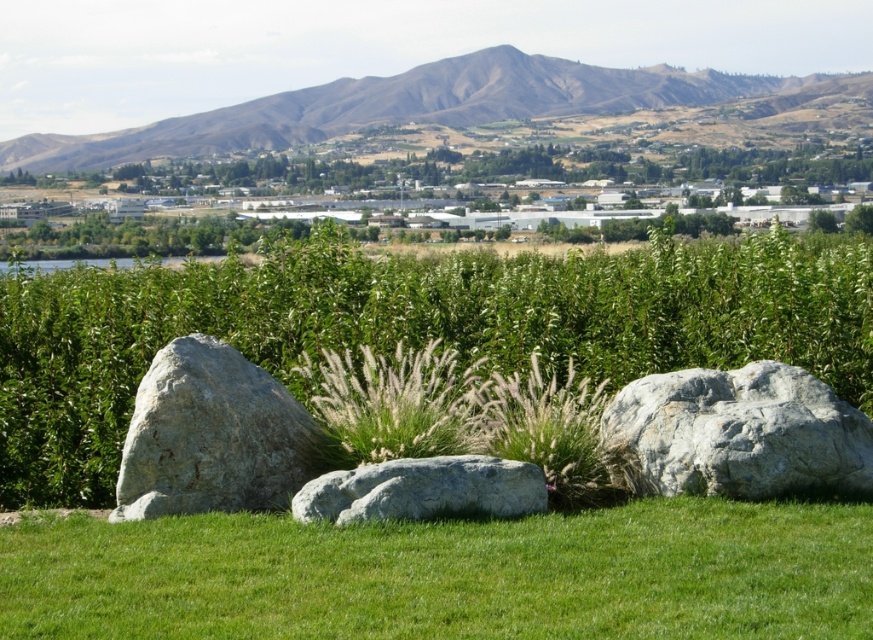
Which is above, brown/dry soil mountain at upper center or gray rock at center-right?

Positioned higher is brown/dry soil mountain at upper center.

Which is in front, point (686, 72) or point (727, 492)?

Positioned in front is point (727, 492).

Locate an element on the screen. The width and height of the screenshot is (873, 640). brown/dry soil mountain at upper center is located at coordinates (425, 106).

Find the location of a particular element. brown/dry soil mountain at upper center is located at coordinates (425, 106).

Is green grass at lower center positioned in front of gray rough boulder at center-left?

That is True.

Is green grass at lower center bigger than gray rough boulder at center-left?

No.

Which is behind, point (810, 561) or point (220, 444)?

The point (220, 444) is more distant.

Find the location of a particular element. The height and width of the screenshot is (640, 873). green grass at lower center is located at coordinates (450, 573).

Can you confirm if green leafy hedge at center is smaller than green grass at lower center?

Incorrect, green leafy hedge at center is not smaller in size than green grass at lower center.

Where is `green leafy hedge at center`? green leafy hedge at center is located at coordinates (411, 326).

At what (x,y) coordinates should I click in order to perform the action: click on green leafy hedge at center. Please return your answer as a coordinate pair (x, y). This screenshot has width=873, height=640. Looking at the image, I should click on (411, 326).